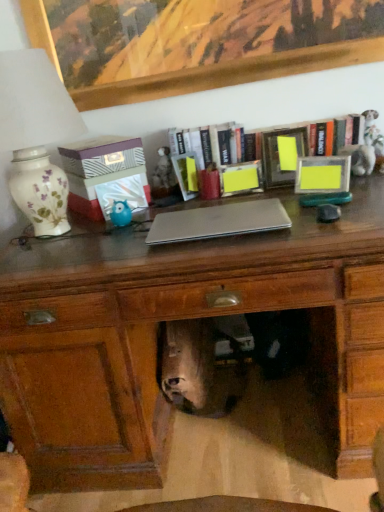
Identify the location of vacant space in front of wooden bookshelf at upper center. The height and width of the screenshot is (512, 384). coord(291,208).